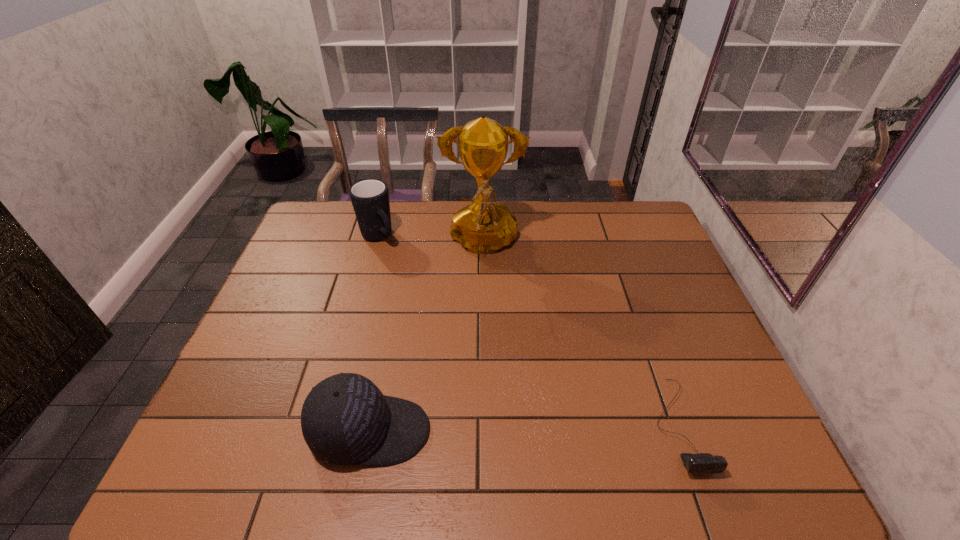
Where is `free space at the right edge of the desktop`? Image resolution: width=960 pixels, height=540 pixels. free space at the right edge of the desktop is located at coordinates (654, 304).

Locate an element on the screen. This screenshot has height=540, width=960. vacant space at the far right corner is located at coordinates (648, 237).

This screenshot has width=960, height=540. In order to click on free region at the near right corner in this screenshot , I will do `click(692, 403)`.

At what (x,y) coordinates should I click in order to perform the action: click on free spot between the third shortest object and the tallest object. Please return your answer as a coordinate pair (x, y). Looking at the image, I should click on (430, 240).

Identify the location of vacant area between the second tallest object and the shortest object. This screenshot has width=960, height=540. (528, 330).

Locate an element on the screen. The image size is (960, 540). free area in between the second tallest object and the award is located at coordinates (430, 240).

You are a GUI agent. You are given a task and a screenshot of the screen. Output one action in this format:
    pyautogui.click(x=<x>, y=<y>)
    Task: Click on the blank region between the second shortest object and the award
    
    Given the screenshot: What is the action you would take?
    pyautogui.click(x=426, y=338)

Identify the location of free space between the second shortest object and the rightmost object. Image resolution: width=960 pixels, height=540 pixels. (524, 428).

The height and width of the screenshot is (540, 960). I want to click on empty space that is in between the baseball cap and the award, so click(x=426, y=338).

Image resolution: width=960 pixels, height=540 pixels. Find the location of `blank region between the mug and the shortest object`. blank region between the mug and the shortest object is located at coordinates (528, 330).